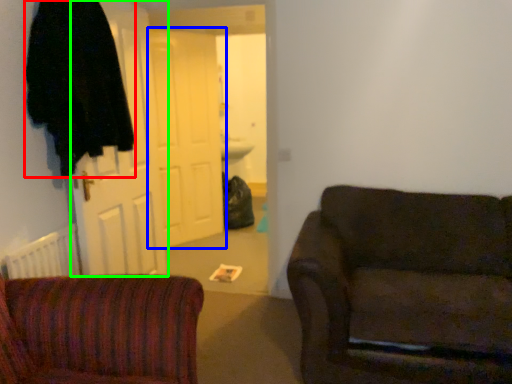
Question: Which is nearer to the robe (highlighted by a red box)? door (highlighted by a blue box) or door (highlighted by a green box).

Choices:
 (A) door
 (B) door

Answer: (B)